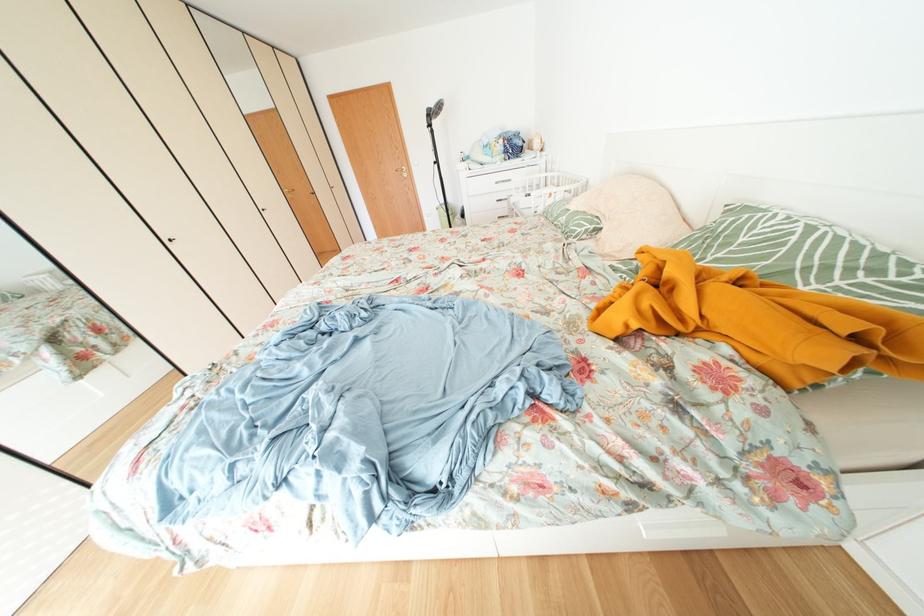
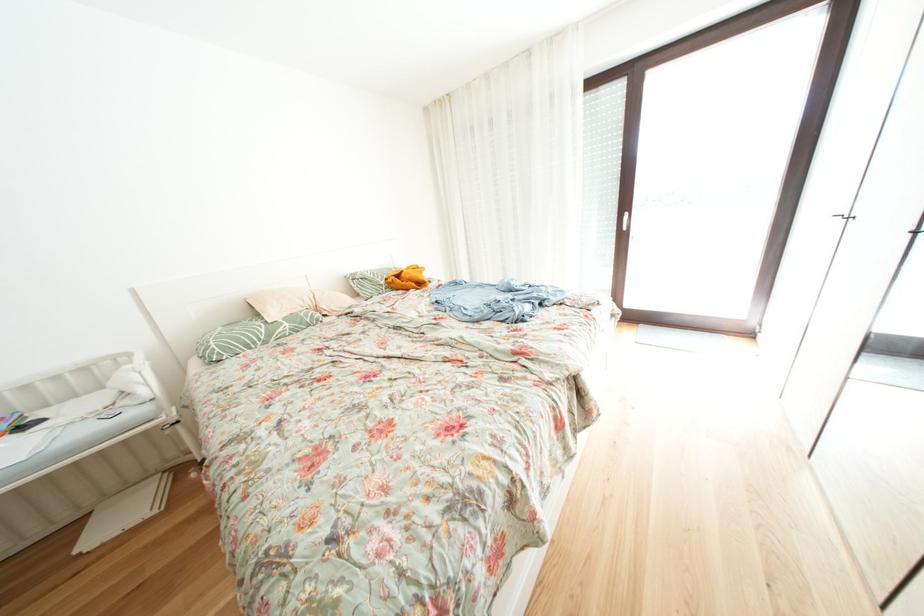
Where in the second image is the point corresponding to the point at 574,223 from the first image?

(296, 329)